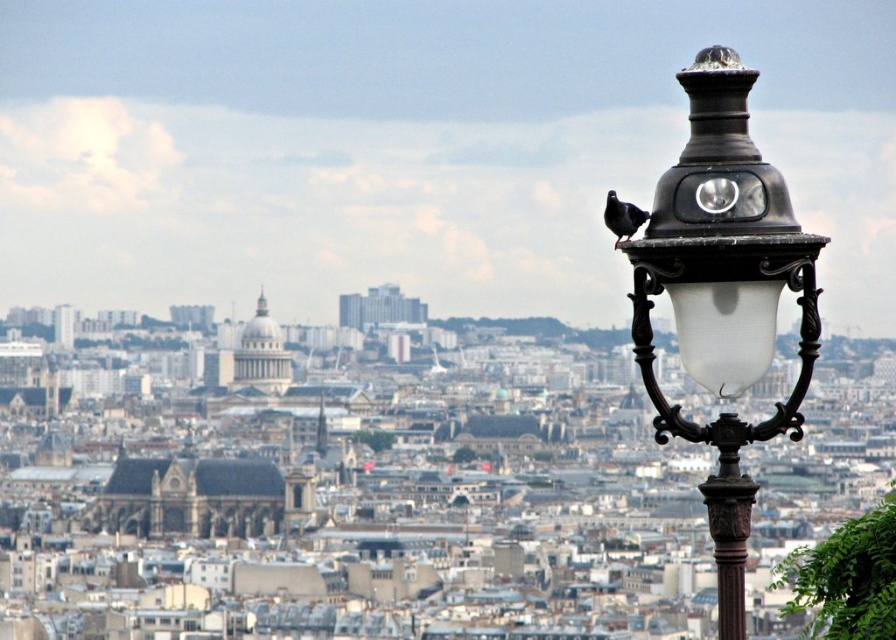
Question: Is black metal street light at upper right positioned behind brown polished metal pole at center-right?

Choices:
 (A) yes
 (B) no

Answer: (B)

Question: Can you confirm if black metal street light at upper right is wider than brown polished metal pole at center-right?

Choices:
 (A) no
 (B) yes

Answer: (A)

Question: Where is black metal street light at upper right located in relation to brown polished metal pole at center-right in the image?

Choices:
 (A) above
 (B) below

Answer: (A)

Question: Which point is closer to the camera taking this photo?

Choices:
 (A) (741, 145)
 (B) (737, 636)

Answer: (B)

Question: Which point is farther to the camera?

Choices:
 (A) black metal street light at upper right
 (B) brown polished metal pole at center-right

Answer: (B)